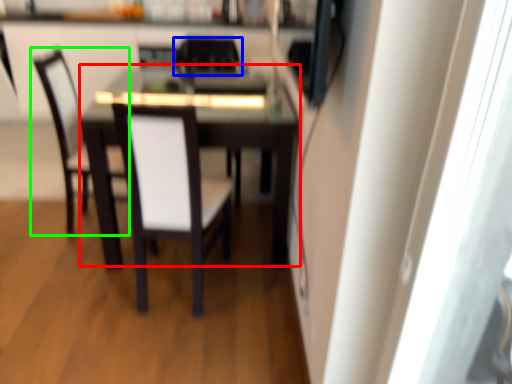
Question: Based on their relative distances, which object is nearer to table (highlighted by a red box)? Choose from chair (highlighted by a blue box) and chair (highlighted by a green box).

Choices:
 (A) chair
 (B) chair

Answer: (A)